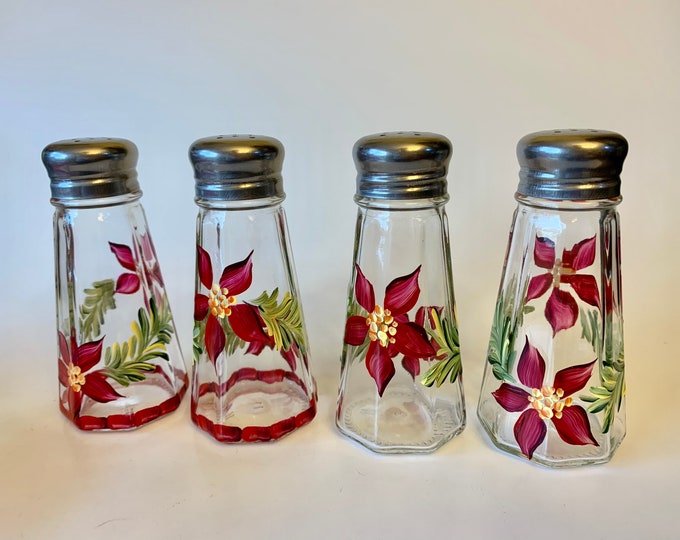
Identify the location of salt shaker 1. (148, 335).